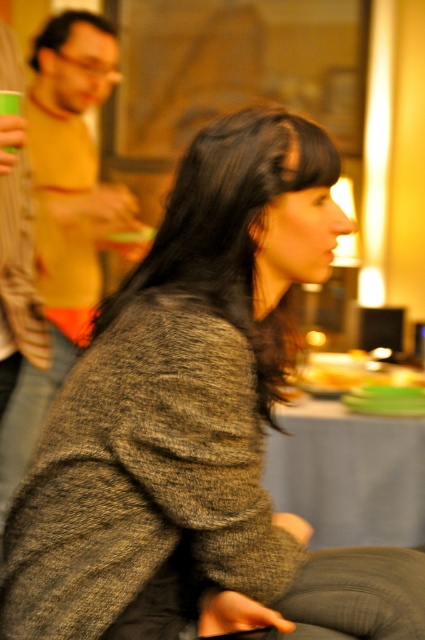
Can you confirm if blue fabric table at center is bigger than matte plastic cup at upper left?

Yes.

Between point (297, 408) and point (19, 96), which one is positioned behind?

Positioned behind is point (297, 408).

Is point (340, 538) more distant than point (11, 150)?

Yes, it is behind point (11, 150).

Locate an element on the screen. The height and width of the screenshot is (640, 425). blue fabric table at center is located at coordinates (348, 474).

From the picture: Is matte yellow shirt at left taller than blue fabric table at center?

Yes, matte yellow shirt at left is taller than blue fabric table at center.

Consider the image. Does matte yellow shirt at left appear under blue fabric table at center?

No, matte yellow shirt at left is not below blue fabric table at center.

Which is in front, point (65, 340) or point (419, 506)?

Positioned in front is point (419, 506).

The height and width of the screenshot is (640, 425). In order to click on matte yellow shirt at left in this screenshot , I will do `click(64, 214)`.

Which is in front, point (78, 269) or point (3, 104)?

Point (3, 104) is in front.

Between matte yellow shirt at left and matte plastic cup at upper left, which one is positioned higher?

matte plastic cup at upper left

Describe the element at coordinates (64, 214) in the screenshot. I see `matte yellow shirt at left` at that location.

Identify the location of matte yellow shirt at left. (64, 214).